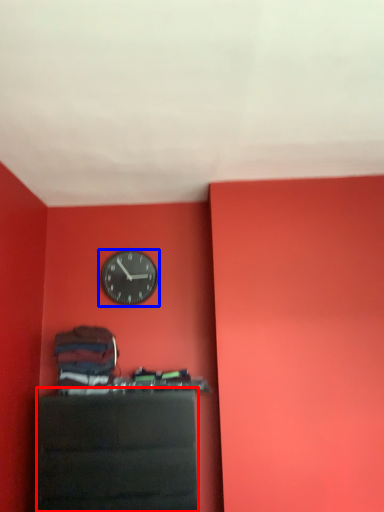
Question: Which point is closer to the camera, furniture (highlighted by a red box) or wall clock (highlighted by a blue box)?

Choices:
 (A) furniture
 (B) wall clock

Answer: (A)